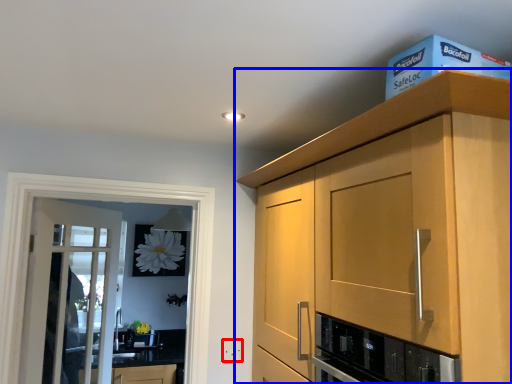
Question: Which object is closer to the camera taking this photo, electric outlet (highlighted by a red box) or cabinetry (highlighted by a blue box)?

Choices:
 (A) electric outlet
 (B) cabinetry

Answer: (B)